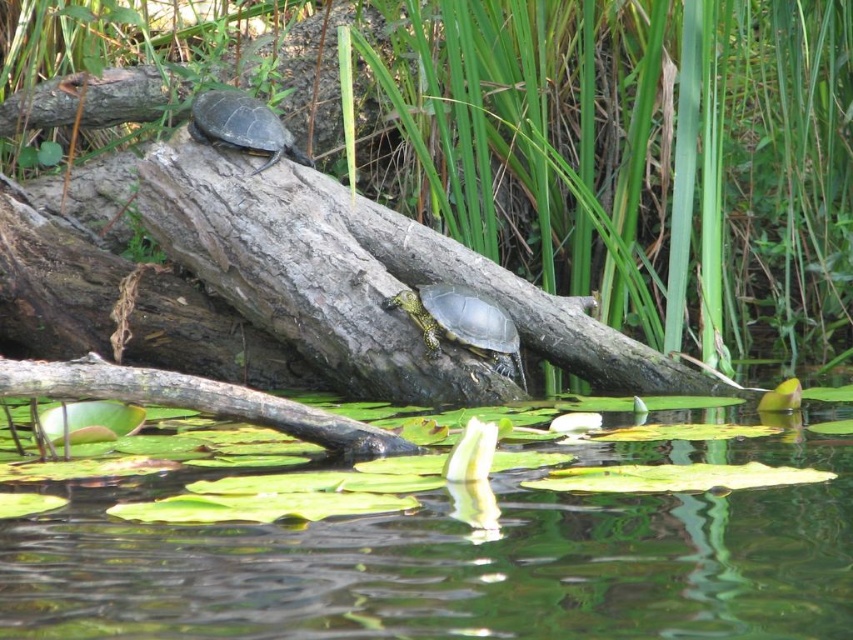
Is green leafy water at center to the right of shiny dark green tortoise at upper left from the viewer's perspective?

Yes, green leafy water at center is to the right of shiny dark green tortoise at upper left.

Can you confirm if green leafy water at center is bigger than shiny dark green tortoise at upper left?

Yes.

This screenshot has width=853, height=640. I want to click on green leafy water at center, so click(x=460, y=561).

Can you confirm if shiny green tortoise at center is taller than shiny dark green tortoise at upper left?

No, shiny green tortoise at center is not taller than shiny dark green tortoise at upper left.

Does shiny green tortoise at center have a greater width compared to shiny dark green tortoise at upper left?

Correct, the width of shiny green tortoise at center exceeds that of shiny dark green tortoise at upper left.

Identify the location of shiny green tortoise at center. The height and width of the screenshot is (640, 853). (462, 323).

Consider the image. Does green leafy vegetation at upper center have a smaller size compared to shiny green tortoise at center?

No.

Is point (380, 232) closer to viewer compared to point (502, 330)?

No, (380, 232) is further to viewer.

Is point (718, 58) closer to viewer compared to point (476, 312)?

No.

You are a GUI agent. You are given a task and a screenshot of the screen. Output one action in this format:
    pyautogui.click(x=<x>, y=<y>)
    Task: Click on the green leafy vegetation at upper center
    The height and width of the screenshot is (640, 853).
    Given the screenshot: What is the action you would take?
    pyautogui.click(x=459, y=244)